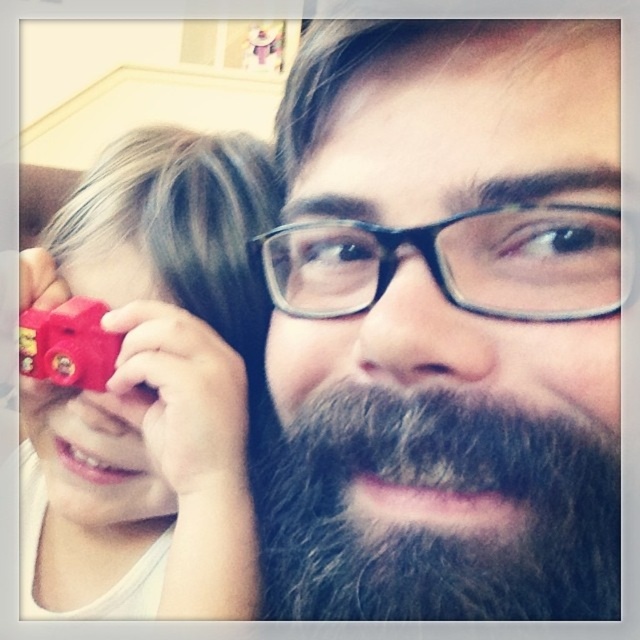
Who is shorter, gray fuzzy beard at center or rubberized plastic train at left?

With less height is rubberized plastic train at left.

Is gray fuzzy beard at center closer to camera compared to rubberized plastic train at left?

Yes, gray fuzzy beard at center is in front of rubberized plastic train at left.

Locate an element on the screen. This screenshot has height=640, width=640. gray fuzzy beard at center is located at coordinates (438, 513).

Is dark brown beard at center positioned in front of gray fuzzy beard at center?

Yes, it is in front of gray fuzzy beard at center.

From the picture: Can you confirm if dark brown beard at center is thinner than gray fuzzy beard at center?

No.

Between point (298, 536) and point (508, 618), which one is positioned behind?

The point (298, 536) is more distant.

Where is `dark brown beard at center`? The image size is (640, 640). dark brown beard at center is located at coordinates (445, 323).

Can you confirm if dark brown beard at center is positioned to the left of rubberized red toy camera at left?

In fact, dark brown beard at center is to the right of rubberized red toy camera at left.

Which is above, dark brown beard at center or rubberized red toy camera at left?

dark brown beard at center is higher up.

Image resolution: width=640 pixels, height=640 pixels. Find the location of `dark brown beard at center`. dark brown beard at center is located at coordinates (445, 323).